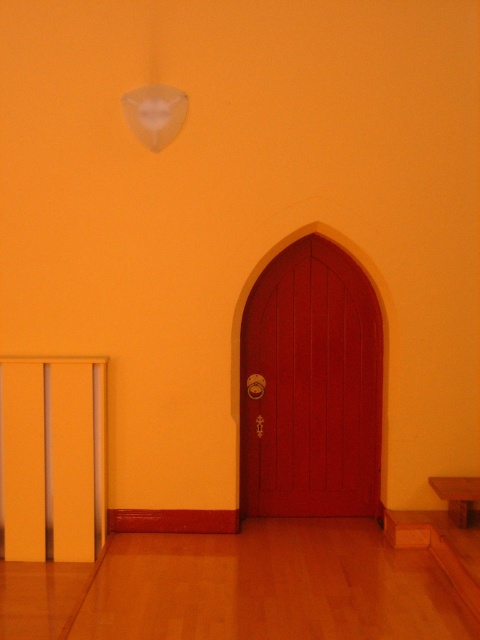
Question: Is matte wood door at center closer to the viewer compared to brown wooden church bench at lower right?

Choices:
 (A) no
 (B) yes

Answer: (A)

Question: From the image, what is the correct spatial relationship of matte wood door at center in relation to brown wooden church bench at lower right?

Choices:
 (A) right
 (B) left

Answer: (B)

Question: From the image, what is the correct spatial relationship of matte wood door at center in relation to brown wooden church bench at lower right?

Choices:
 (A) above
 (B) below

Answer: (A)